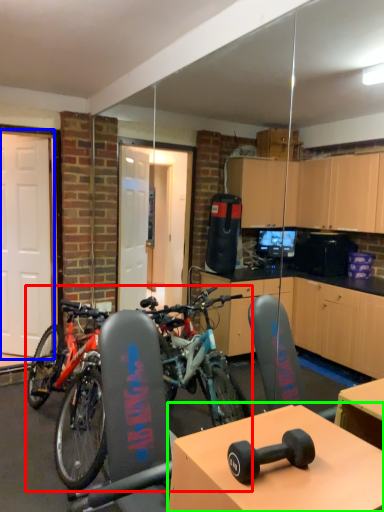
Question: Based on their relative distances, which object is farther from bicycle (highlighted by a red box)? Choose from garage door (highlighted by a blue box) and table (highlighted by a green box).

Choices:
 (A) garage door
 (B) table

Answer: (B)